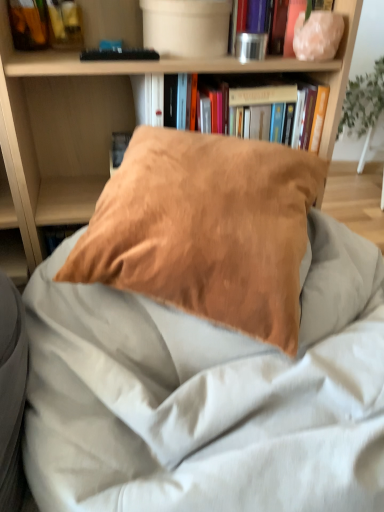
Question: Does matte brown pillow at center have a greater height compared to metallic silver canister at upper center, arranged as the second book when ordered from the bottom?

Choices:
 (A) no
 (B) yes

Answer: (B)

Question: Is matte brown pillow at center far away from metallic silver canister at upper center, arranged as the second book when ordered from the bottom?

Choices:
 (A) no
 (B) yes

Answer: (A)

Question: Does matte brown pillow at center have a lesser height compared to metallic silver canister at upper center, the first book when ordered from top to bottom?

Choices:
 (A) no
 (B) yes

Answer: (A)

Question: From the image's perspective, is matte brown pillow at center above metallic silver canister at upper center, arranged as the second book when ordered from the bottom?

Choices:
 (A) yes
 (B) no

Answer: (B)

Question: Is matte brown pillow at center further to camera compared to metallic silver canister at upper center, the first book when ordered from top to bottom?

Choices:
 (A) yes
 (B) no

Answer: (B)

Question: Based on their sizes in the image, would you say hardcover book at upper center, placed as the second book when sorted from top to bottom, is bigger or smaller than suede-like brown pillow at center?

Choices:
 (A) small
 (B) big

Answer: (A)

Question: From a real-world perspective, relative to suede-like brown pillow at center, is hardcover book at upper center, placed as the second book when sorted from top to bottom, vertically above or below?

Choices:
 (A) above
 (B) below

Answer: (A)

Question: Is point (170, 74) closer or farther from the camera than point (196, 233)?

Choices:
 (A) closer
 (B) farther

Answer: (B)

Question: Is hardcover book at upper center, which appears as the 1th book when ordered from the bottom, inside or outside of suede-like brown pillow at center?

Choices:
 (A) outside
 (B) inside

Answer: (A)

Question: Would you say metallic silver canister at upper center, the first book when ordered from top to bottom, is inside or outside hardcover book at upper center, placed as the second book when sorted from top to bottom?

Choices:
 (A) outside
 (B) inside

Answer: (A)

Question: From a real-world perspective, is metallic silver canister at upper center, the first book when ordered from top to bottom, above or below hardcover book at upper center, which appears as the 1th book when ordered from the bottom?

Choices:
 (A) below
 (B) above

Answer: (B)

Question: Is metallic silver canister at upper center, the first book when ordered from top to bottom, to the left or to the right of hardcover book at upper center, which appears as the 1th book when ordered from the bottom, in the image?

Choices:
 (A) right
 (B) left

Answer: (A)

Question: Is metallic silver canister at upper center, arranged as the second book when ordered from the bottom, taller or shorter than hardcover book at upper center, placed as the second book when sorted from top to bottom?

Choices:
 (A) tall
 (B) short

Answer: (B)

Question: From the image's perspective, relative to suede-like brown pillow at center, is green leafy plant at upper right above or below?

Choices:
 (A) below
 (B) above

Answer: (B)

Question: From a real-world perspective, is green leafy plant at upper right above or below suede-like brown pillow at center?

Choices:
 (A) above
 (B) below

Answer: (B)